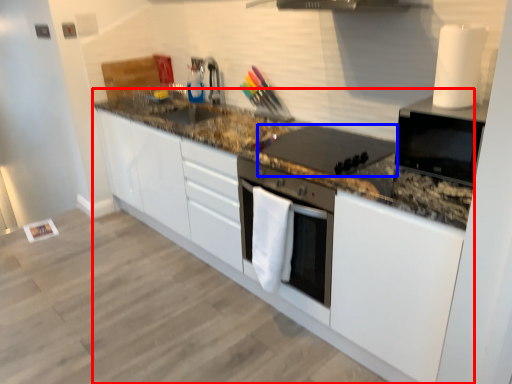
Question: Which object appears closest to the camera in this image, countertop (highlighted by a red box) or kitchen appliance (highlighted by a blue box)?

Choices:
 (A) countertop
 (B) kitchen appliance

Answer: (A)